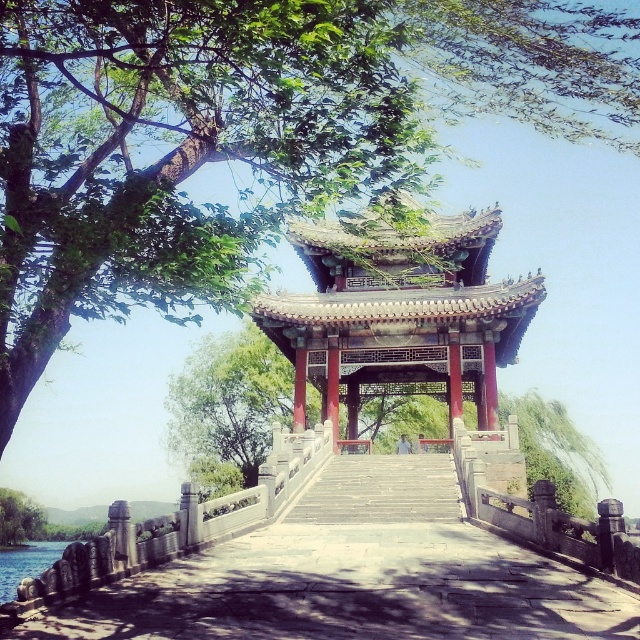
Is green leafy tree at upper left shorter than green leafy tree at center?

Yes, green leafy tree at upper left is shorter than green leafy tree at center.

Between point (160, 64) and point (221, 433), which one is positioned behind?

The point (221, 433) is behind.

Where is `green leafy tree at upper left`? This screenshot has width=640, height=640. green leafy tree at upper left is located at coordinates tap(244, 132).

Is point (248, 348) closer to viewer compared to point (32, 508)?

That is True.

Is green leafy tree at center shorter than green leafy tree at lower left?

Incorrect, green leafy tree at center's height does not fall short of green leafy tree at lower left's.

Which is behind, point (236, 438) or point (1, 540)?

Positioned behind is point (1, 540).

Find the location of a particular element. green leafy tree at center is located at coordinates (228, 404).

Is gray stone bridge at center smaller than stone/wooden gazebo at center?

Correct, gray stone bridge at center occupies less space than stone/wooden gazebo at center.

Does gray stone bridge at center have a lesser width compared to stone/wooden gazebo at center?

Correct, gray stone bridge at center's width is less than stone/wooden gazebo at center's.

Is point (630, 596) closer to viewer compared to point (346, 282)?

Yes, it is in front of point (346, 282).

Locate an element on the screen. The height and width of the screenshot is (640, 640). gray stone bridge at center is located at coordinates (349, 589).